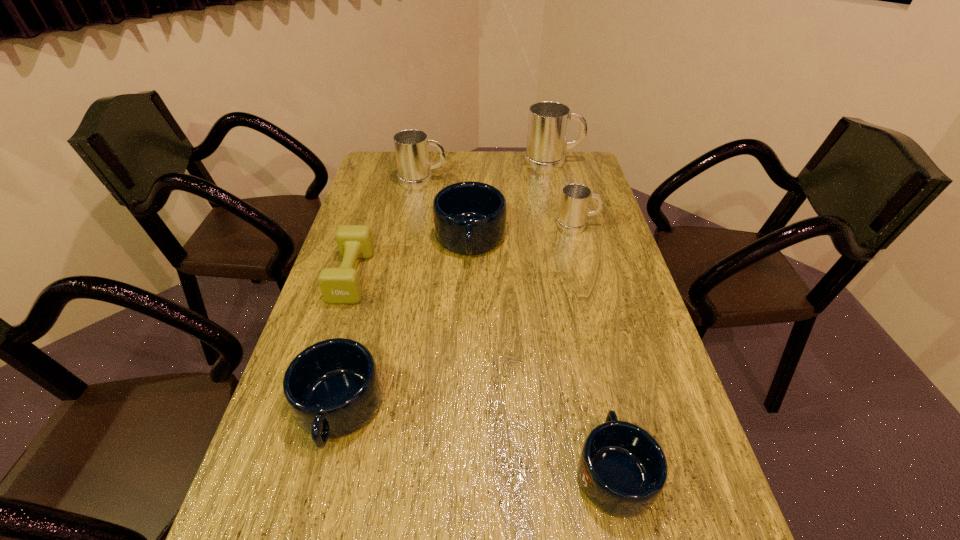
The height and width of the screenshot is (540, 960). In order to click on the tallest object in this screenshot , I will do `click(548, 121)`.

Find the location of a particular element. The width and height of the screenshot is (960, 540). the tallest mug is located at coordinates (548, 121).

Where is `the fifth shortest mug`? The image size is (960, 540). the fifth shortest mug is located at coordinates (411, 146).

Locate an element on the screen. Image resolution: width=960 pixels, height=540 pixels. the second tallest object is located at coordinates (411, 146).

What are the coordinates of `the biggest blue mug` in the screenshot? It's located at (469, 217).

Identify the location of the farthest blue mug. (469, 217).

Locate an element on the screen. the nearest gray mug is located at coordinates (575, 199).

At what (x,y) coordinates should I click in order to perform the action: click on the leftmost blue mug. Please return your answer as a coordinate pair (x, y). This screenshot has width=960, height=540. Looking at the image, I should click on (333, 388).

Find the location of a particular element. the second smallest blue mug is located at coordinates (333, 388).

This screenshot has height=540, width=960. Find the location of `olive dumbbell`. olive dumbbell is located at coordinates (341, 285).